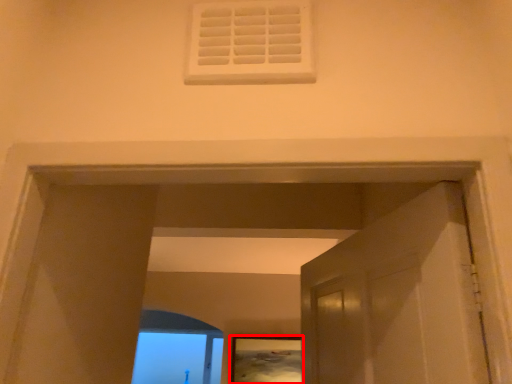
Question: From the image's perspective, what is the correct spatial positioning of picture frame (annotated by the red box) in reference to window frame?

Choices:
 (A) below
 (B) above

Answer: (B)